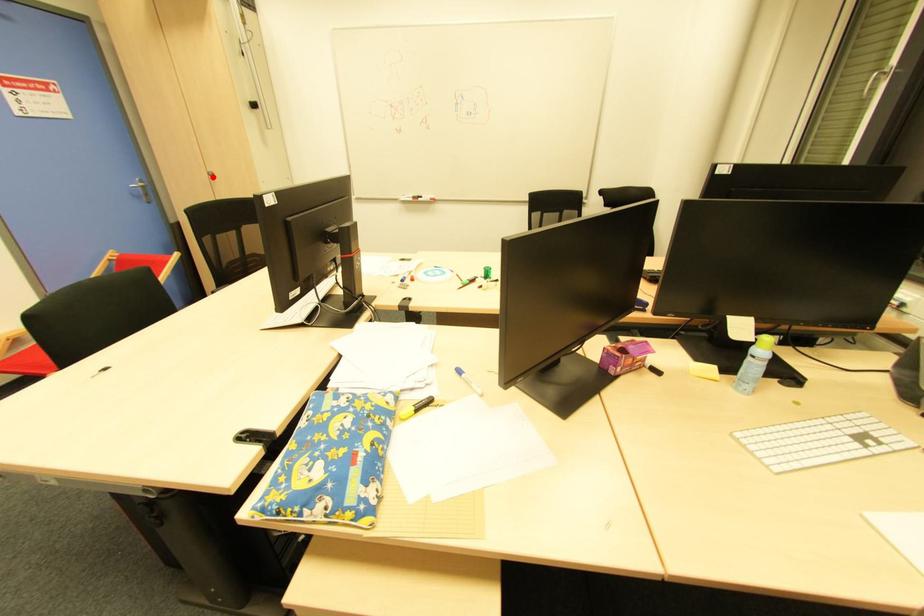
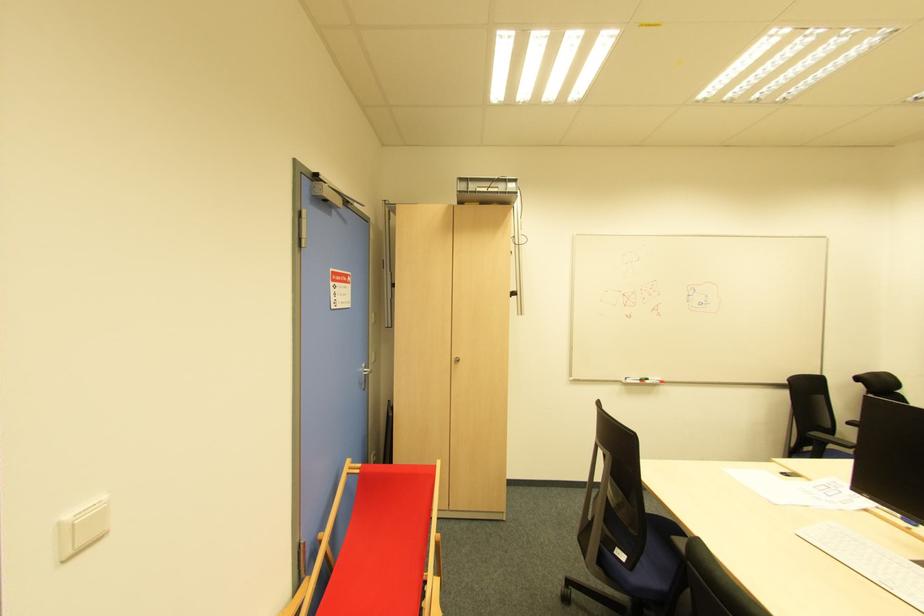
Where in the second image is the point corresponding to the highlighted location from the first image?

(457, 362)